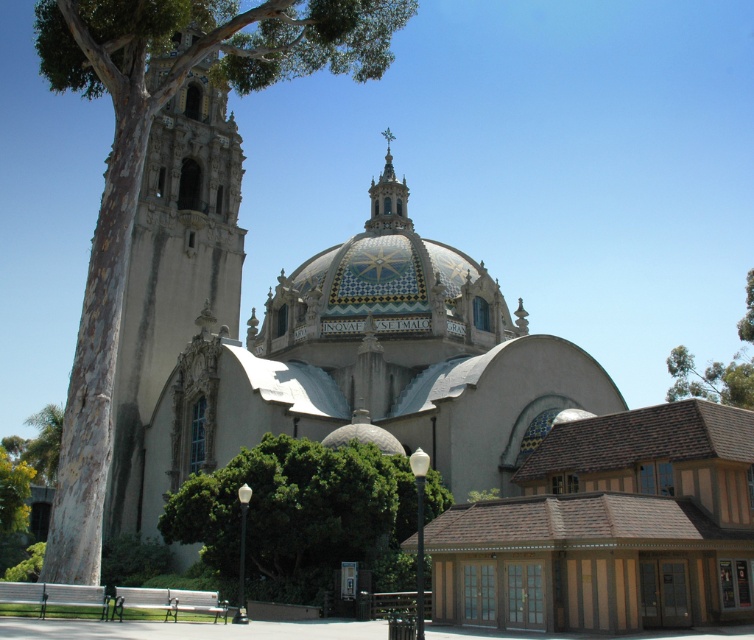
You are an architect analyzing the proportions of the building in the image. Which object, the green leafy tree at upper right or the gold mosaic spire at upper center, occupies more visual space in the composition?

The green leafy tree at upper right occupies more visual space in the composition as it is larger in size than the gold mosaic spire at upper center.

You are standing at the entrance of the grand building and notice two points marked on the structure. The first point is at coordinates point (167, 4) and the second is at point (385, 177). Which of these points is closer to you as you face the building?

Point (167, 4) is closer to you because it is in front of point (385, 177).

In the scene shown: You are standing in front of the grand architectural structure and see the point marked at coordinate (141, 176). What object is located at that point?

The point at coordinate (141, 176) marks a smooth bark tree at left.